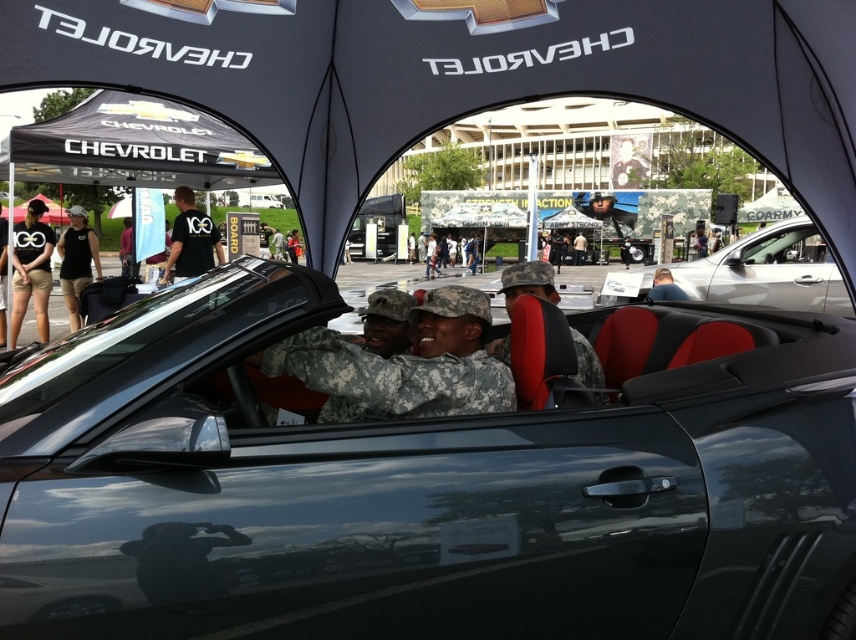
Is the position of glossy black convertible at center more distant than that of silver metallic car at center?

That is False.

How distant is glossy black convertible at center from silver metallic car at center?

A distance of 22.32 feet exists between glossy black convertible at center and silver metallic car at center.

Is point (168, 483) less distant than point (658, 268)?

That is True.

At what (x,y) coordinates should I click in order to perform the action: click on glossy black convertible at center. Please return your answer as a coordinate pair (x, y). The image size is (856, 640). Looking at the image, I should click on (420, 483).

Between glossy black convertible at center and camouflage fabric uniform at center, which one appears on the left side from the viewer's perspective?

From the viewer's perspective, camouflage fabric uniform at center appears more on the left side.

Where is `glossy black convertible at center`? This screenshot has width=856, height=640. glossy black convertible at center is located at coordinates (420, 483).

Locate an element on the screen. glossy black convertible at center is located at coordinates (420, 483).

Is point (736, 289) closer to camera compared to point (31, 220)?

That is False.

Can you confirm if silver metallic car at center is smaller than black cotton shirt at left?

Yes.

Which is behind, point (776, 262) or point (39, 225)?

The point (776, 262) is behind.

Where is `silver metallic car at center`? silver metallic car at center is located at coordinates (770, 272).